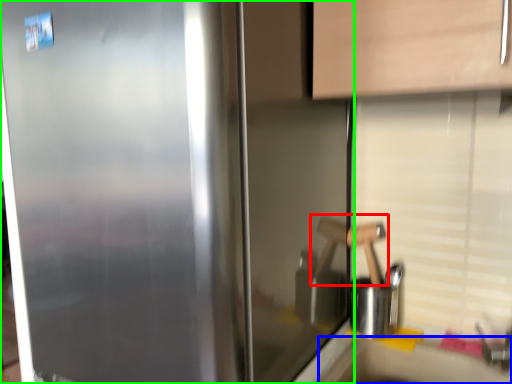
Question: Estimate the real-world distances between objects in this image. Which object is farther from door handle (highlighted by a red box), counter top (highlighted by a blue box) or refrigerator (highlighted by a green box)?

Choices:
 (A) counter top
 (B) refrigerator

Answer: (B)